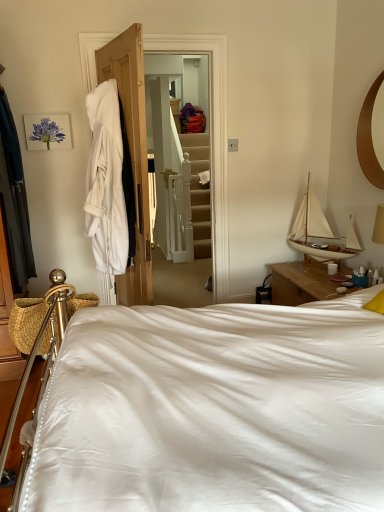
What is the approximate width of matte purple flower at upper left?

1.33 inches.

The width and height of the screenshot is (384, 512). What do you see at coordinates (315, 228) in the screenshot?
I see `white wood sailboat at upper right` at bounding box center [315, 228].

At what (x,y) coordinates should I click in order to perform the action: click on dark blue fabric at left, the 1th clothing viewed from the left. Please return your answer as a coordinate pair (x, y). This screenshot has height=512, width=384. Looking at the image, I should click on coord(14,198).

What are the coordinates of `wooden mirror at upper right` in the screenshot? It's located at (369, 138).

This screenshot has width=384, height=512. What do you see at coordinates (298, 283) in the screenshot?
I see `white satin bed at center` at bounding box center [298, 283].

I want to click on white satin bed at center, so click(298, 283).

Locate an element on the screen. white ceramic mug at upper right is located at coordinates (332, 268).

Measure the distance between white cloth at left and camera.

The depth of white cloth at left is 3.00 meters.

Describe the element at coordinates (109, 183) in the screenshot. I see `white cotton bathrobe at left, the 1th clothing positioned from the right` at that location.

Image resolution: width=384 pixels, height=512 pixels. Identify the location of matte purple flower at upper left. (48, 132).

Is white ceramic mug at upper right looking in the opposite direction of wooden mirror at upper right?

No, wooden mirror at upper right is not at the back of white ceramic mug at upper right.

In the scene shown: Does white ceramic mug at upper right have a greater width compared to wooden mirror at upper right?

No, white ceramic mug at upper right is not wider than wooden mirror at upper right.

From a real-world perspective, is white ceramic mug at upper right on top of wooden mirror at upper right?

Actually, white ceramic mug at upper right is physically below wooden mirror at upper right in the real world.

From the image's perspective, is white ceramic mug at upper right on top of wooden mirror at upper right?

No.

Could you tell me if white cloth at left is facing white satin bed at center?

Yes, white cloth at left is turned towards white satin bed at center.

Who is more distant, white cloth at left or white satin bed at center?

white cloth at left is more distant.

From the picture: Can you confirm if white cloth at left is smaller than white satin bed at center?

Correct, white cloth at left occupies less space than white satin bed at center.

Is wooden mirror at upper right located outside white wood sailboat at upper right?

Yes, wooden mirror at upper right is outside of white wood sailboat at upper right.

Considering the positions of point (374, 155) and point (345, 249), is point (374, 155) closer or farther from the camera than point (345, 249)?

Point (374, 155) is positioned closer to the camera compared to point (345, 249).

In the scene shown: Between wooden mirror at upper right and white wood sailboat at upper right, which one is positioned in front?

Positioned in front is wooden mirror at upper right.

Considering the relative positions of wooden mirror at upper right and white wood sailboat at upper right in the image provided, is wooden mirror at upper right to the left or to the right of white wood sailboat at upper right?

From the image, it's evident that wooden mirror at upper right is to the right of white wood sailboat at upper right.

Where is `boat behind the white cotton bathrobe at left, the 1th clothing positioned from the right`? boat behind the white cotton bathrobe at left, the 1th clothing positioned from the right is located at coordinates (315, 228).

Is white wood sailboat at upper right situated inside white cotton bathrobe at left, which is the 2th clothing from left to right, or outside?

white wood sailboat at upper right is outside white cotton bathrobe at left, which is the 2th clothing from left to right.

Is white wood sailboat at upper right wider or thinner than white cotton bathrobe at left, which is the 2th clothing from left to right?

Considering their sizes, white wood sailboat at upper right looks broader than white cotton bathrobe at left, which is the 2th clothing from left to right.

Is white wood sailboat at upper right aimed at white cotton bathrobe at left, which is the 2th clothing from left to right?

Yes, white wood sailboat at upper right is facing white cotton bathrobe at left, which is the 2th clothing from left to right.

Which of these two, white ceramic mug at upper right or white wood sailboat at upper right, is bigger?

Bigger between the two is white wood sailboat at upper right.

Considering their positions, is white ceramic mug at upper right located in front of or behind white wood sailboat at upper right?

white ceramic mug at upper right is positioned farther from the viewer than white wood sailboat at upper right.

Between white ceramic mug at upper right and white wood sailboat at upper right, which one has more height?

white wood sailboat at upper right is taller.

Measure the distance between white wood sailboat at upper right and white ceramic mug at upper right.

They are 13.24 inches apart.

Is white wood sailboat at upper right aimed at white ceramic mug at upper right?

No, white wood sailboat at upper right is not oriented towards white ceramic mug at upper right.

From the image's perspective, which is below, white wood sailboat at upper right or white ceramic mug at upper right?

white ceramic mug at upper right, from the image's perspective.

Locate an element on the screen. This screenshot has width=384, height=512. coffee cup below the white wood sailboat at upper right (from a real-world perspective) is located at coordinates (332, 268).

I want to click on coffee cup located below the white cotton bathrobe at left, the 1th clothing positioned from the right (from the image's perspective), so click(332, 268).

Based on their sizes in the image, would you say white ceramic mug at upper right is bigger or smaller than white cotton bathrobe at left, which is the 2th clothing from left to right?

In the image, white ceramic mug at upper right appears to be smaller than white cotton bathrobe at left, which is the 2th clothing from left to right.

Looking at this image, from a real-world perspective, is white ceramic mug at upper right over white cotton bathrobe at left, which is the 2th clothing from left to right?

Actually, white ceramic mug at upper right is physically below white cotton bathrobe at left, which is the 2th clothing from left to right, in the real world.

Can you see white ceramic mug at upper right touching white cotton bathrobe at left, the 1th clothing positioned from the right?

No, white ceramic mug at upper right is not beside white cotton bathrobe at left, the 1th clothing positioned from the right.

The width and height of the screenshot is (384, 512). In order to click on coffee cup on the left of wooden mirror at upper right in this screenshot , I will do `click(332, 268)`.

You are a GUI agent. You are given a task and a screenshot of the screen. Output one action in this format:
    pyautogui.click(x=<x>, y=<y>)
    Task: Click on the bed on the right of the white cloth at left
    
    Given the screenshot: What is the action you would take?
    pyautogui.click(x=298, y=283)

In the scene shown: When comparing their distances from matte purple flower at upper left, does white cotton bathrobe at left, the 1th clothing positioned from the right, or white ceramic mug at upper right seem further?

white ceramic mug at upper right is further to matte purple flower at upper left.

In the scene shown: From the image, which object appears to be nearer to white ceramic mug at upper right, wooden mirror at upper right or white satin bed at center?

white satin bed at center.

Considering their positions, is white cloth at left positioned further to wooden mirror at upper right than dark blue fabric at left, which is counted as the second clothing, starting from the right?

The object further to wooden mirror at upper right is dark blue fabric at left, which is counted as the second clothing, starting from the right.

Considering their positions, is matte purple flower at upper left positioned closer to white cloth at left than wooden mirror at upper right?

Based on the image, matte purple flower at upper left appears to be nearer to white cloth at left.

Based on their spatial positions, is wooden mirror at upper right or white satin bed at center further from dark blue fabric at left, the 1th clothing viewed from the left?

The object further to dark blue fabric at left, the 1th clothing viewed from the left, is wooden mirror at upper right.

When comparing their distances from white ceramic mug at upper right, does white cotton bathrobe at left, which is the 2th clothing from left to right, or wooden mirror at upper right seem closer?

wooden mirror at upper right is closer to white ceramic mug at upper right.

Based on their spatial positions, is white satin bed at center or white ceramic mug at upper right closer to dark blue fabric at left, which is counted as the second clothing, starting from the right?

white satin bed at center lies closer to dark blue fabric at left, which is counted as the second clothing, starting from the right, than the other object.

Based on their spatial positions, is white cloth at left or white cotton bathrobe at left, which is the 2th clothing from left to right, closer to dark blue fabric at left, the 1th clothing viewed from the left?

Among the two, white cotton bathrobe at left, which is the 2th clothing from left to right, is located nearer to dark blue fabric at left, the 1th clothing viewed from the left.

Find the location of `clothing positioned between dark blue fabric at left, the 1th clothing viewed from the left, and matte purple flower at upper left from near to far`. clothing positioned between dark blue fabric at left, the 1th clothing viewed from the left, and matte purple flower at upper left from near to far is located at coordinates (109, 183).

The height and width of the screenshot is (512, 384). Find the location of `picture frame between white satin bed at center and white ceramic mug at upper right in the front-back direction`. picture frame between white satin bed at center and white ceramic mug at upper right in the front-back direction is located at coordinates (48, 132).

Locate an element on the screen. closet between white satin bed at center and white ceramic mug at upper right in the front-back direction is located at coordinates (210, 137).

Find the location of a particular element. This screenshot has height=512, width=384. picture frame between dark blue fabric at left, which is counted as the second clothing, starting from the right, and wooden mirror at upper right is located at coordinates 48,132.